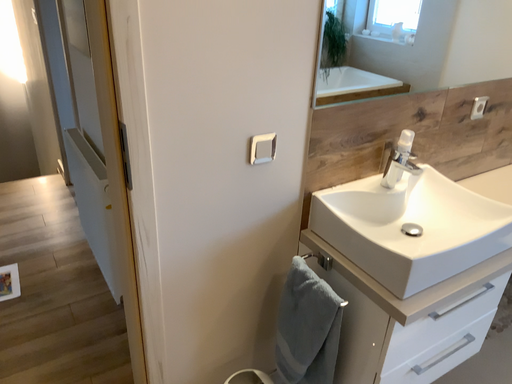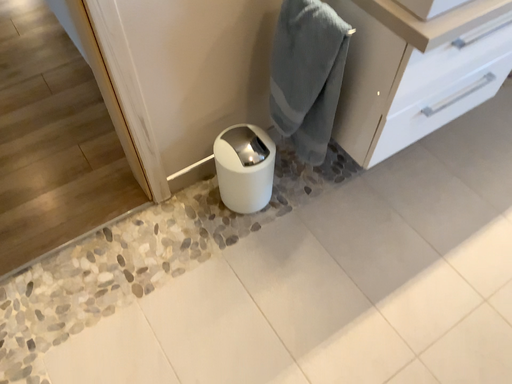
Question: How did the camera likely rotate when shooting the video?

Choices:
 (A) rotated upward
 (B) rotated downward

Answer: (B)